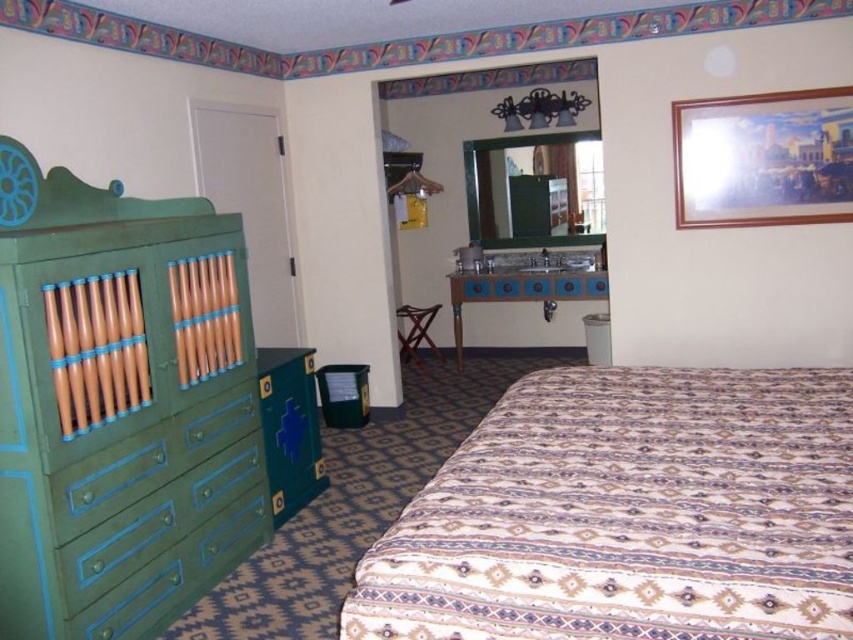
Question: Among these objects, which one is nearest to the camera?

Choices:
 (A) green painted wood dresser at left
 (B) patterned fabric bed at lower right
 (C) green matte drawer at left

Answer: (B)

Question: Can you confirm if patterned fabric bed at lower right is positioned above green painted wood dresser at left?

Choices:
 (A) yes
 (B) no

Answer: (B)

Question: Which object is farther from the camera taking this photo?

Choices:
 (A) green matte drawer at left
 (B) green painted wood dresser at left

Answer: (A)

Question: Is patterned fabric bed at lower right positioned at the back of green painted wood dresser at left?

Choices:
 (A) yes
 (B) no

Answer: (B)

Question: Does patterned fabric bed at lower right have a larger size compared to green matte drawer at left?

Choices:
 (A) no
 (B) yes

Answer: (B)

Question: Based on their relative distances, which object is nearer to the patterned fabric bed at lower right?

Choices:
 (A) green painted wood dresser at left
 (B) green matte drawer at left

Answer: (B)